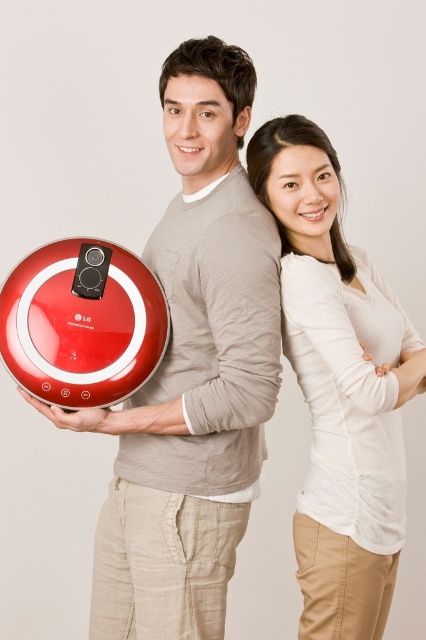
Is metallic red robot vacuum cleaner at left to the left of red plastic vacuum cleaner at lower left from the viewer's perspective?

No, metallic red robot vacuum cleaner at left is not to the left of red plastic vacuum cleaner at lower left.

From the picture: Can you confirm if metallic red robot vacuum cleaner at left is shorter than red plastic vacuum cleaner at lower left?

Incorrect, metallic red robot vacuum cleaner at left's height does not fall short of red plastic vacuum cleaner at lower left's.

What do you see at coordinates (192, 372) in the screenshot?
I see `metallic red robot vacuum cleaner at left` at bounding box center [192, 372].

This screenshot has height=640, width=426. I want to click on metallic red robot vacuum cleaner at left, so click(x=192, y=372).

Can you confirm if metallic red robot vacuum cleaner at left is smaller than matte white blouse at center?

Actually, metallic red robot vacuum cleaner at left might be larger than matte white blouse at center.

At what (x,y) coordinates should I click in order to perform the action: click on metallic red robot vacuum cleaner at left. Please return your answer as a coordinate pair (x, y). Looking at the image, I should click on (192, 372).

I want to click on metallic red robot vacuum cleaner at left, so click(x=192, y=372).

Can you confirm if matte white blouse at center is wider than red plastic vacuum cleaner at lower left?

Indeed, matte white blouse at center has a greater width compared to red plastic vacuum cleaner at lower left.

Who is more distant from viewer, (345, 289) or (100, 378)?

The point (345, 289) is behind.

Where is `matte white blouse at center`? This screenshot has width=426, height=640. matte white blouse at center is located at coordinates (339, 387).